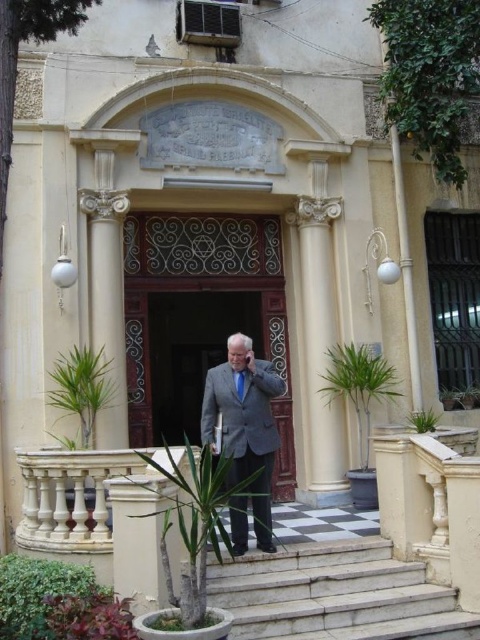
Is point (336, 588) farther from camera compared to point (237, 385)?

No, it is in front of (237, 385).

From the picture: Does white marble stairs at center appear on the left side of blue silk tie at center?

In fact, white marble stairs at center is to the right of blue silk tie at center.

Does point (315, 586) come closer to viewer compared to point (240, 371)?

Yes, point (315, 586) is closer to viewer.

Locate an element on the screen. This screenshot has height=640, width=480. white marble stairs at center is located at coordinates (335, 595).

Can you confirm if white marble stairs at center is taller than light gray suit at center?

Incorrect, white marble stairs at center's height is not larger of light gray suit at center's.

Does white marble stairs at center have a larger size compared to light gray suit at center?

No.

I want to click on white marble stairs at center, so click(x=335, y=595).

Is point (256, 349) positioned after point (235, 381)?

Yes.

Between wooden door at center and blue silk tie at center, which one is positioned higher?

Positioned higher is wooden door at center.

Measure the distance between point (230, 243) and camera.

13.10 meters

Locate an element on the screen. Image resolution: width=480 pixels, height=640 pixels. wooden door at center is located at coordinates (201, 317).